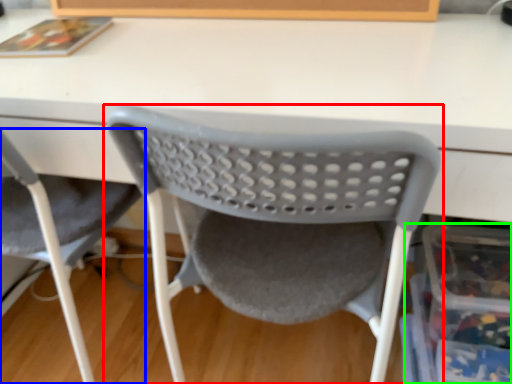
Question: Which is farther away from chair (highlighted by a red box)? chair (highlighted by a blue box) or storage box (highlighted by a green box)?

Choices:
 (A) chair
 (B) storage box

Answer: (A)